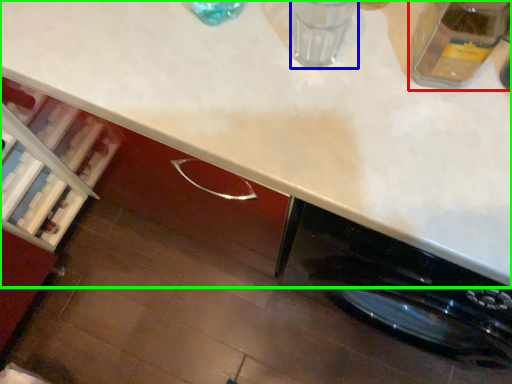
Question: Which is nearer to the glass jar (highlighted by a red box)? water (highlighted by a blue box) or countertop (highlighted by a green box).

Choices:
 (A) water
 (B) countertop

Answer: (A)